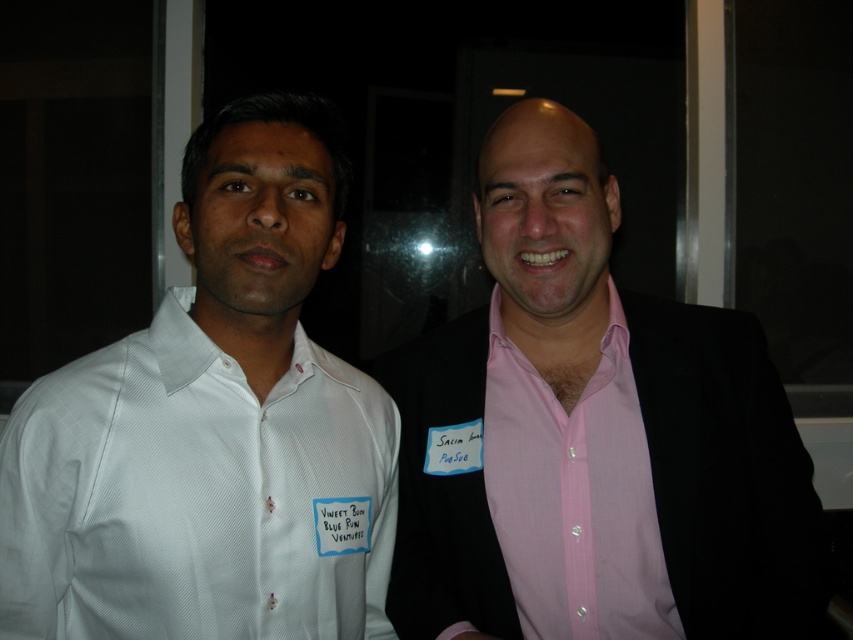
You are standing in a dimly lit room with two people. You see a point at position (541, 145) and another point at (622, 566). Which point is closer to you?

Point (541, 145) is closer to you because it is in front of point (622, 566).

In the scene shown: You are a photographer trying to capture a closeup of the pink satin shirt at center. The camera is currently focused on the point at coordinates (x=598, y=416). Is the pink satin shirt at center in focus?

Yes, the pink satin shirt at center is in focus because the point at coordinates (x=598, y=416) marks the pink satin shirt at center.